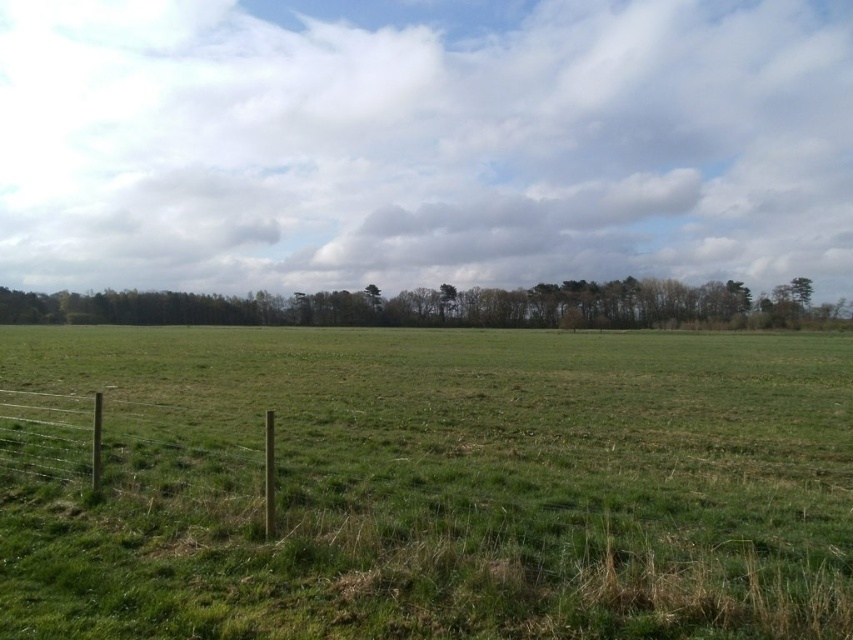
Who is lower down, green leafy trees at upper center or brown wooden fence at lower left?

brown wooden fence at lower left is lower down.

Is point (224, 305) closer to viewer compared to point (219, 436)?

No.

What do you see at coordinates (430, 307) in the screenshot? I see `green leafy trees at upper center` at bounding box center [430, 307].

Locate an element on the screen. green leafy trees at upper center is located at coordinates (430, 307).

Does point (329, 620) lie in front of point (77, 496)?

Yes, it is in front of point (77, 496).

Between green grass pasture at center and brown wooden fence at lower left, which one is positioned lower?

Positioned lower is brown wooden fence at lower left.

Looking at this image, measure the distance between point (x=722, y=545) and camera.

5.65 meters

This screenshot has height=640, width=853. I want to click on green grass pasture at center, so click(425, 484).

Based on the photo, can you confirm if green grass pasture at center is taller than green leafy trees at upper center?

No.

Looking at this image, is green grass pasture at center positioned before green leafy trees at upper center?

Yes, green grass pasture at center is closer to the viewer.

At what (x,y) coordinates should I click in order to perform the action: click on green grass pasture at center. Please return your answer as a coordinate pair (x, y). The width and height of the screenshot is (853, 640). Looking at the image, I should click on (425, 484).